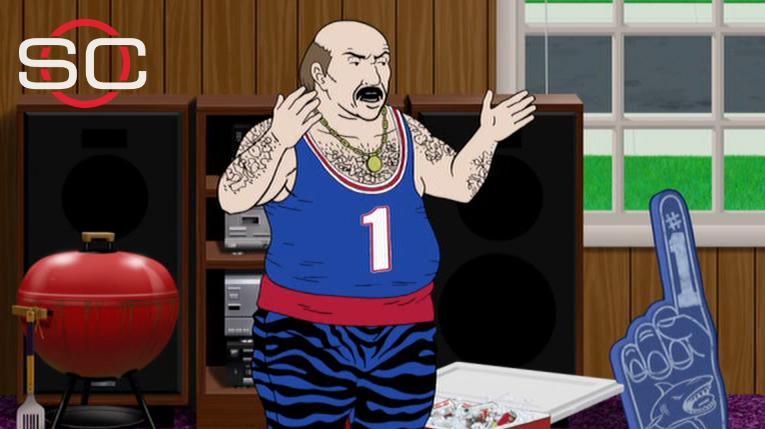
Locate an element on the screen. This screenshot has width=765, height=429. window is located at coordinates (653, 101).